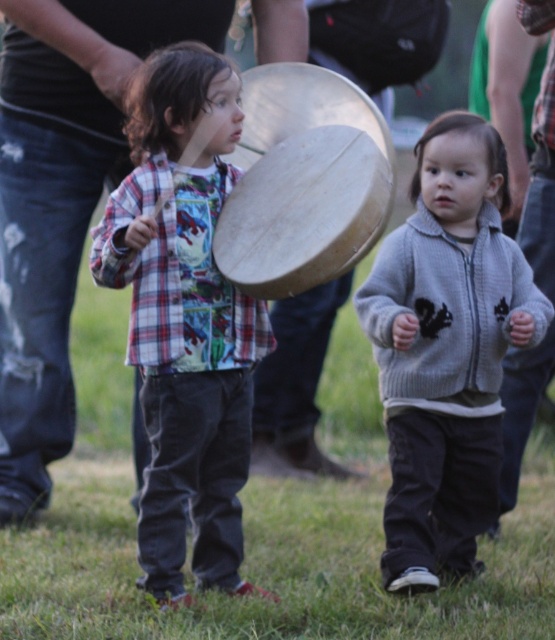
Does plaid shirt at center lie behind gray knitted sweater at center?

No, it is in front of gray knitted sweater at center.

What are the coordinates of `plaid shirt at center` in the screenshot? It's located at (184, 317).

Is point (194, 392) closer to camera compared to point (445, 161)?

Yes, point (194, 392) is closer to viewer.

This screenshot has width=555, height=640. I want to click on plaid shirt at center, so click(x=184, y=317).

Is plaid shirt at center above wooden tambourine at center?

Incorrect, plaid shirt at center is not positioned above wooden tambourine at center.

Does plaid shirt at center have a greater height compared to wooden tambourine at center?

Correct, plaid shirt at center is much taller as wooden tambourine at center.

Is point (134, 83) closer to camera compared to point (240, 257)?

No, (134, 83) is further to viewer.

Identify the location of plaid shirt at center. The image size is (555, 640). (184, 317).

Identify the location of gray knitted sweater at center. (446, 349).

Is gray knitted sweater at center to the right of wooden tambourine at center from the viewer's perspective?

Indeed, gray knitted sweater at center is positioned on the right side of wooden tambourine at center.

Is point (473, 240) positioned after point (360, 154)?

Yes, it is behind point (360, 154).

You are a GUI agent. You are given a task and a screenshot of the screen. Output one action in this format:
    pyautogui.click(x=<x>, y=<y>)
    Task: Click on the gray knitted sweater at center
    The width and height of the screenshot is (555, 640).
    Given the screenshot: What is the action you would take?
    pyautogui.click(x=446, y=349)